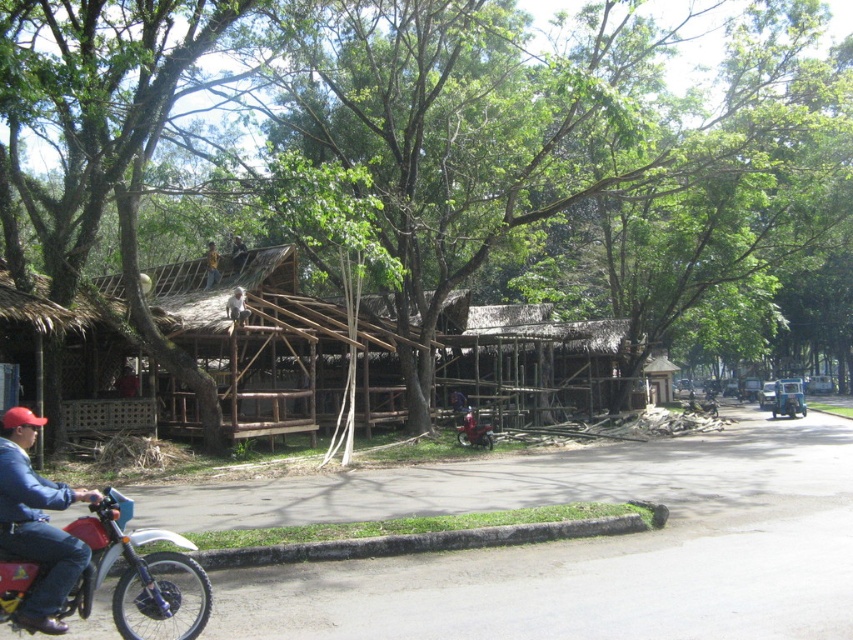
You are a pedestrian standing on the road and see the green leafy tree at center and the red matte motorcycle at lower left. Which object is closer to your right side?

The green leafy tree at center is to the right of the red matte motorcycle at lower left, so the green leafy tree at center is closer to your right side.

You are a delivery person who needs to park your red matte motorcycle at center near the brown wooden monkey at upper center. Can you park the motorcycle there without blocking the monkey?

The red matte motorcycle at center might be wider than brown wooden monkey at upper center, so there is a possibility that parking the motorcycle could block the monkey. Check the space carefully before parking.

What are the coordinates of the red matte motorcycle at center?

The coordinates of the red matte motorcycle at center are at point (473, 429).